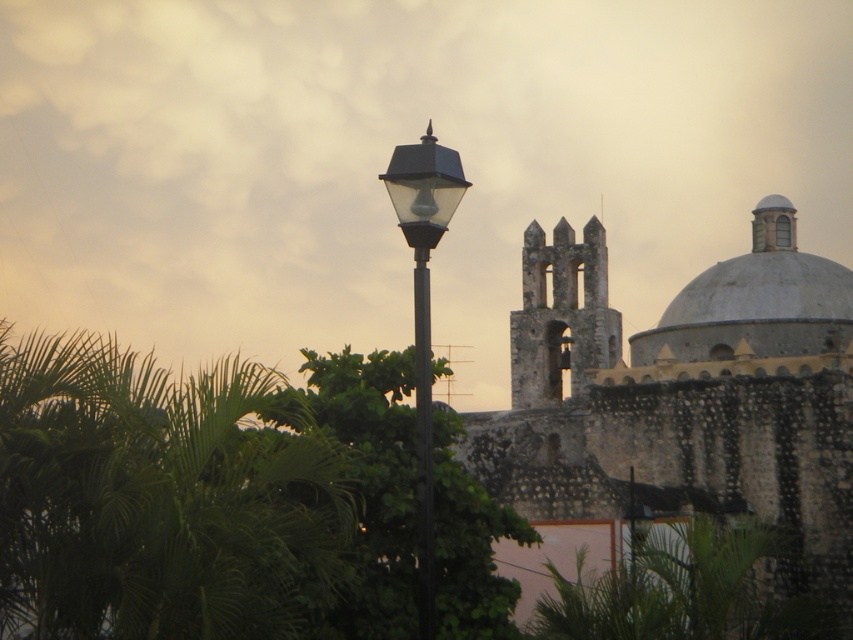
Between point (74, 134) and point (405, 490), which one is positioned in front?

Point (405, 490) is in front.

Consider the image. Can you confirm if cloudy sky at upper center is bigger than green leafy tree at center?

Indeed, cloudy sky at upper center has a larger size compared to green leafy tree at center.

Is point (471, 28) behind point (450, 497)?

Yes, it is.

Locate an element on the screen. This screenshot has width=853, height=640. cloudy sky at upper center is located at coordinates (387, 157).

Who is taller, green leafy tree at center or white smooth dome at upper right?

green leafy tree at center

In order to click on green leafy tree at center in this screenshot , I will do `click(364, 486)`.

Measure the distance between green leafy tree at center and camera.

A distance of 227.52 feet exists between green leafy tree at center and camera.

Find the location of a particular element. The height and width of the screenshot is (640, 853). green leafy tree at center is located at coordinates (364, 486).

Can you confirm if stone tower at center is taller than black metal pole at center?

Correct, stone tower at center is much taller as black metal pole at center.

Is point (556, 369) positioned behind point (430, 360)?

Yes, it is behind point (430, 360).

Who is more distant from viewer, (532, 272) or (424, 468)?

The point (532, 272) is more distant.

Identify the location of stone tower at center. (561, 316).